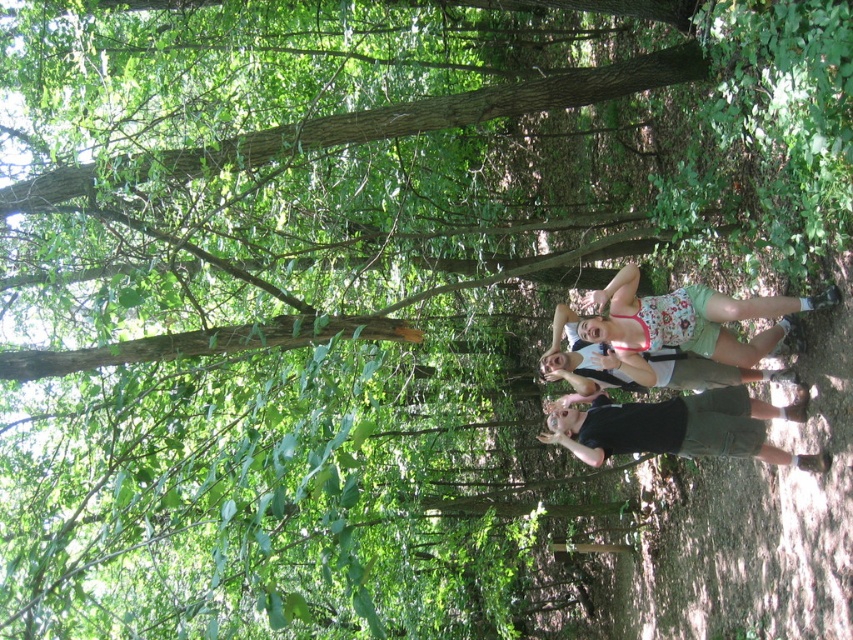
Is floral fabric shorts at center positioned at the back of black matte shorts at lower right?

No, floral fabric shorts at center is closer to the viewer.

Is floral fabric shorts at center bigger than black matte shorts at lower right?

Correct, floral fabric shorts at center is larger in size than black matte shorts at lower right.

At what (x,y) coordinates should I click in order to perform the action: click on floral fabric shorts at center. Please return your answer as a coordinate pair (x, y). Looking at the image, I should click on (682, 323).